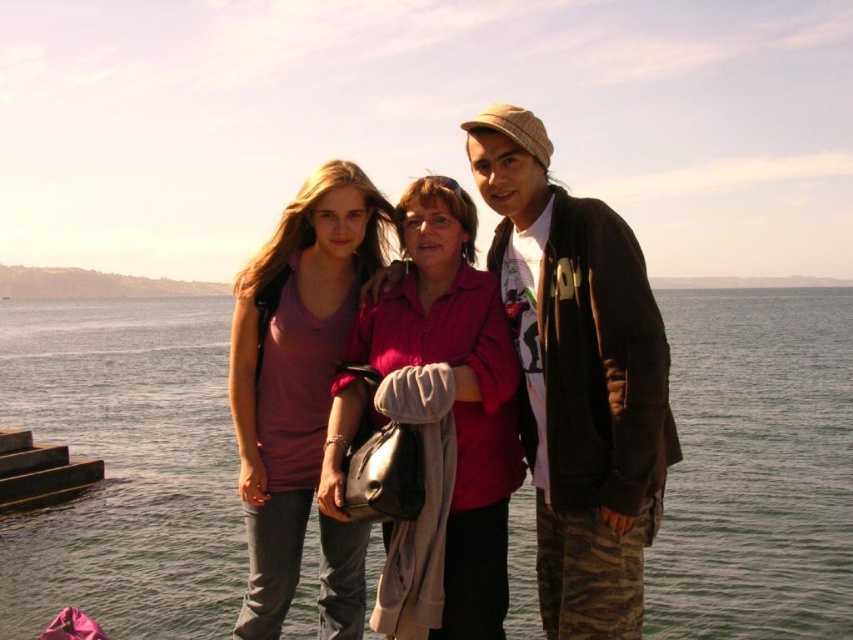
Between point (352, 547) and point (399, 349), which one is positioned in front?

Positioned in front is point (399, 349).

In order to click on matte purple shirt at center in this screenshot , I will do `click(294, 369)`.

Which is behind, point (286, 500) or point (477, 323)?

Positioned behind is point (286, 500).

Find the location of a particular element. The image size is (853, 640). matte purple shirt at center is located at coordinates (294, 369).

Who is positioned more to the right, camouflage pants at right or matte pink shirt at center?

From the viewer's perspective, camouflage pants at right appears more on the right side.

Can you confirm if camouflage pants at right is bigger than matte pink shirt at center?

Indeed, camouflage pants at right has a larger size compared to matte pink shirt at center.

This screenshot has width=853, height=640. What do you see at coordinates (578, 378) in the screenshot?
I see `camouflage pants at right` at bounding box center [578, 378].

You are a GUI agent. You are given a task and a screenshot of the screen. Output one action in this format:
    pyautogui.click(x=<x>, y=<y>)
    Task: Click on the camouflage pants at right
    This screenshot has width=853, height=640.
    Given the screenshot: What is the action you would take?
    pyautogui.click(x=578, y=378)

Is pink matte shirt at center below matte purple shirt at center?

Incorrect, pink matte shirt at center is not positioned below matte purple shirt at center.

Does point (625, 340) come farther from viewer compared to point (248, 621)?

No, (625, 340) is closer to viewer.

Where is `pink matte shirt at center`? pink matte shirt at center is located at coordinates (578, 378).